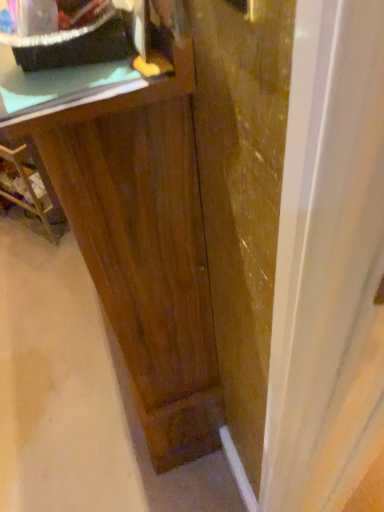
Locate an element on the screen. The width and height of the screenshot is (384, 512). free spot in front of dark wood cabinet at left is located at coordinates point(34,262).